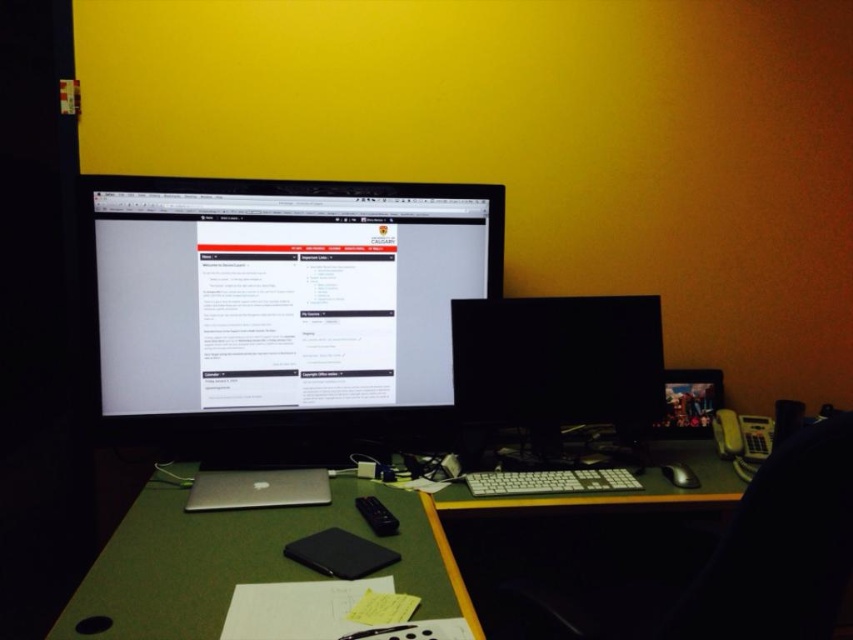
You are sitting in the black plastic chair at right and want to reach the black plastic mouse at lower right. Is the mouse within easy reach from your current position?

The black plastic chair at right is in front of the black plastic mouse at lower right, so the mouse is positioned directly in front of you. Since it is close by, it should be easily reachable from your current position in the black plastic chair at right.

You are sitting in the black plastic chair at right and want to reach the black plastic mouse at lower right. Can you easily reach the mouse without moving your chair?

The black plastic chair at right is positioned under the black plastic mouse at lower right, so you can easily reach the mouse while sitting in the chair without needing to move it.